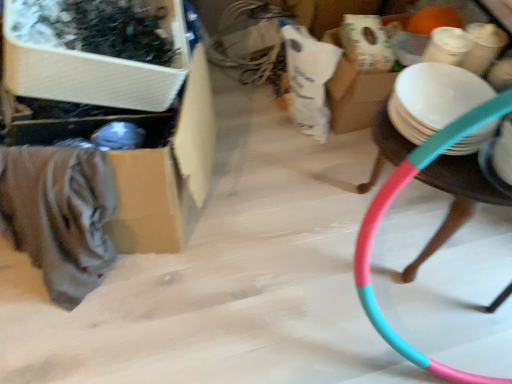
Locate an element on the screen. This screenshot has width=512, height=384. vacant space to the right of cardboard box at left, which appears as the second storage box when viewed from the front is located at coordinates (266, 208).